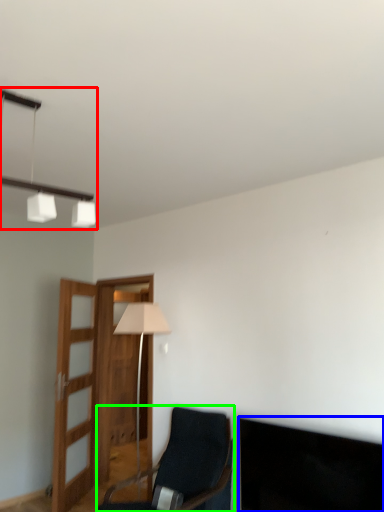
Question: Which object is the farthest from lamp (highlighted by a red box)? Choose among these: dark (highlighted by a blue box) or chair (highlighted by a green box).

Choices:
 (A) dark
 (B) chair

Answer: (B)